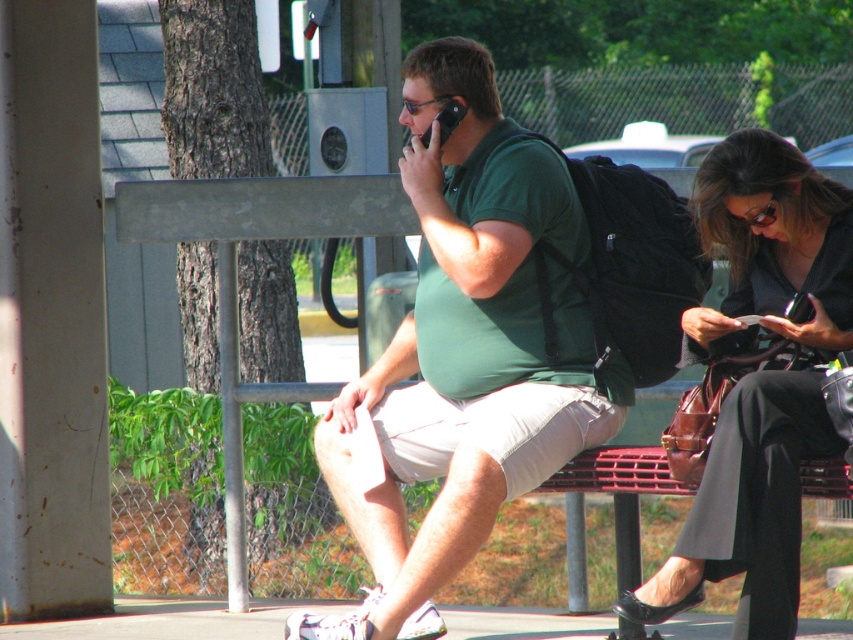
You are standing at the bus stop and want to sit down. There are two empty spots on the bench marked by points. The first spot is at point [691,310] and the second is at point [440,134]. Which of these two points is closer to you if you are facing the bench?

Point [691,310] is in front of point [440,134], so the first spot is closer to you when facing the bench.

You are designing a new bench for a public space and want to ensure there is enough space between the green matte shirt at center and the black plastic phone at upper center. Based on their sizes, which object requires more horizontal space on the bench?

The green matte shirt at center requires more horizontal space on the bench because its width surpasses that of the black plastic phone at upper center.